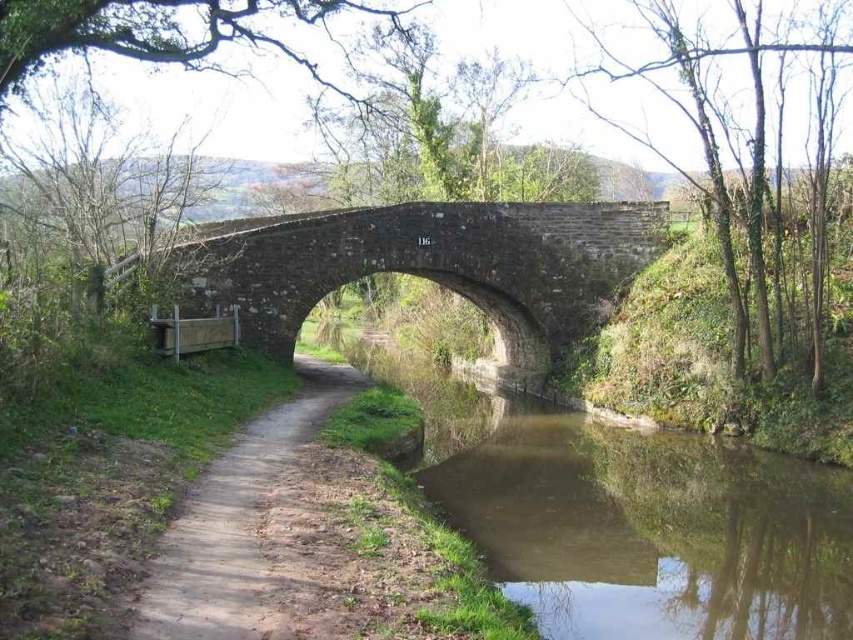
Based on the scene description, what is located at the coordinates point (625,515)?

The brown smooth water at lower center is located at point (625,515).

You are a tourist standing on the brown stone bridge at center and want to take a photo of the brown smooth water at lower center. Which direction should you look to capture the water in the frame?

Since the brown smooth water at lower center is shorter than the brown stone bridge at center, you should look downward to capture the water in the frame.

Based on the photo, you are standing on the stone bridge and want to check the water level at the center of the canal. According to the coordinates provided, where exactly should you look to see the brown smooth water at lower center?

You should look at point (625, 515) to see the brown smooth water at lower center.